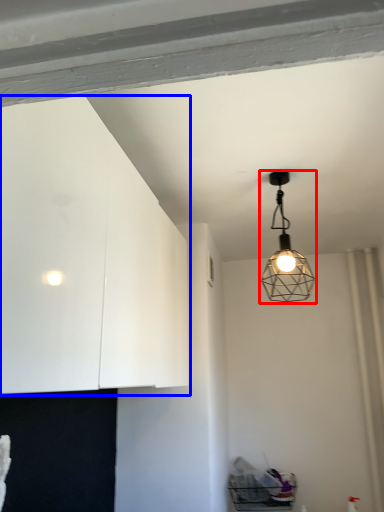
Question: Which of the following is the farthest to the observer, lamp (highlighted by a red box) or dresser (highlighted by a blue box)?

Choices:
 (A) lamp
 (B) dresser

Answer: (A)